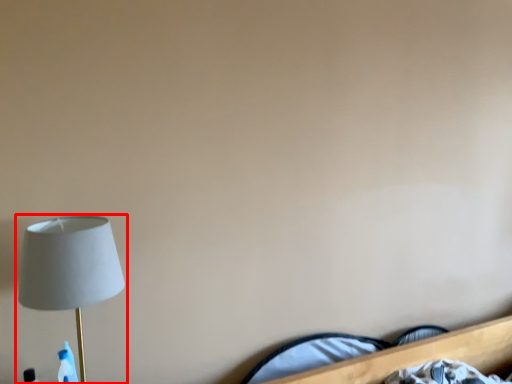
Question: Considering the relative positions of lamp (annotated by the red box) and bed in the image provided, where is lamp (annotated by the red box) located with respect to the staircase?

Choices:
 (A) left
 (B) right

Answer: (A)